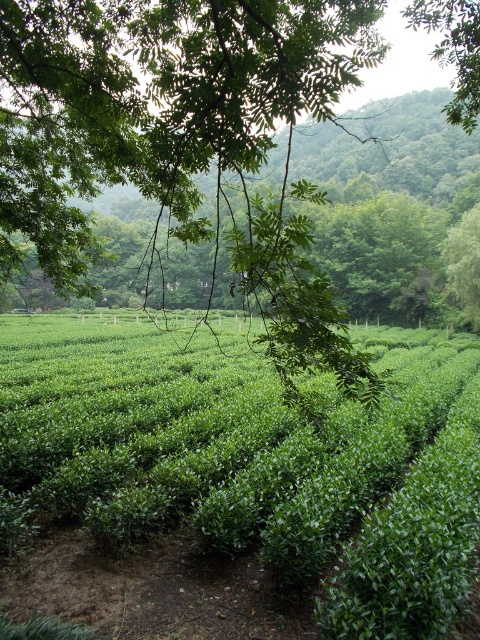
Question: Does green leafy hedge at center have a lesser width compared to green leafy tree at upper left?

Choices:
 (A) no
 (B) yes

Answer: (B)

Question: Which of the following is the closest to the observer?

Choices:
 (A) green leafy hedge at center
 (B) green leafy tree at upper left

Answer: (B)

Question: Does green leafy hedge at center lie in front of green leafy tree at upper left?

Choices:
 (A) no
 (B) yes

Answer: (A)

Question: Can you confirm if green leafy hedge at center is bigger than green leafy tree at upper left?

Choices:
 (A) yes
 (B) no

Answer: (B)